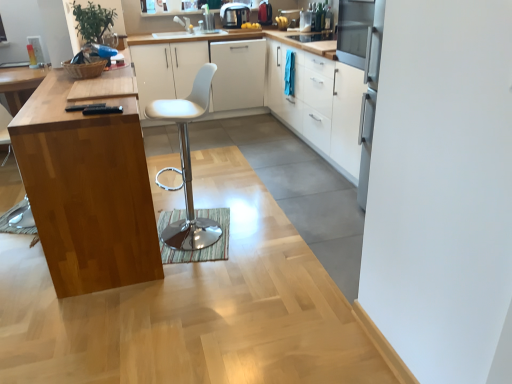
You are a GUI agent. You are given a task and a screenshot of the screen. Output one action in this format:
    pyautogui.click(x=<x>, y=<y>)
    Task: Click on the vacant area that lies in front of wooden cutting board at left
    
    Given the screenshot: What is the action you would take?
    pyautogui.click(x=117, y=317)